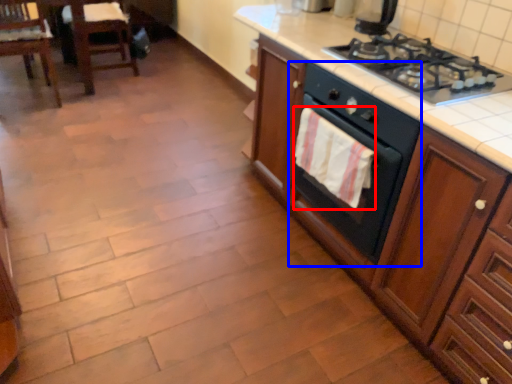
Question: Which of the following is the closest to the observer, hand towel (highlighted by a red box) or oven (highlighted by a blue box)?

Choices:
 (A) hand towel
 (B) oven

Answer: (B)